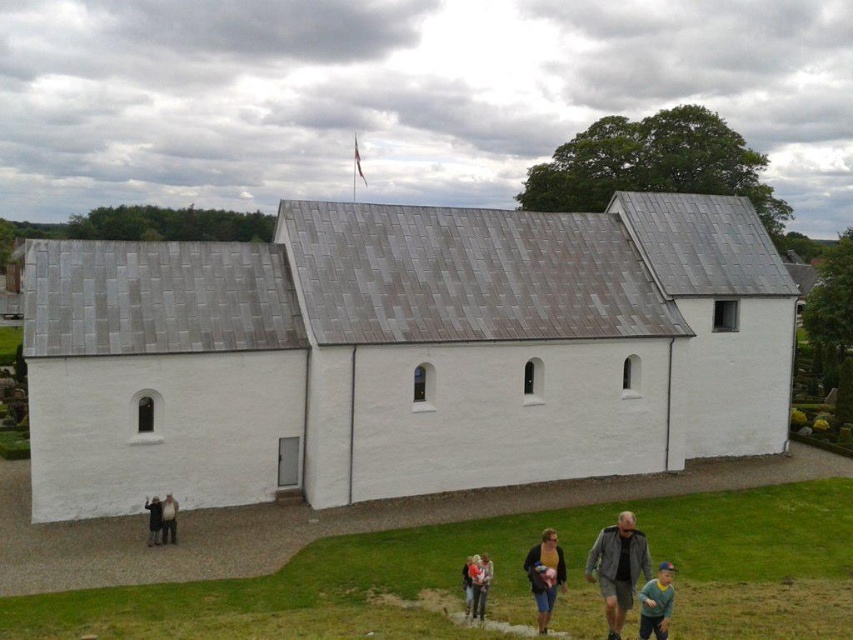
You are standing in the cemetery and want to walk to the white smooth chapel at center. There is a dark blue fabric at lower center in your path. Which object should you avoid stepping on?

You should avoid stepping on the dark blue fabric at lower center because the white smooth chapel at center is further away, meaning the dark blue fabric is closer to you and blocking your path.

Based on the photo, you are standing at the edge of the cemetery looking towards the church. There is a dark blue fabric at lower center and a white smooth chapel at center. Which object is closer to your right side?

The dark blue fabric at lower center is closer to your right side because the white smooth chapel at center is to the left of it.